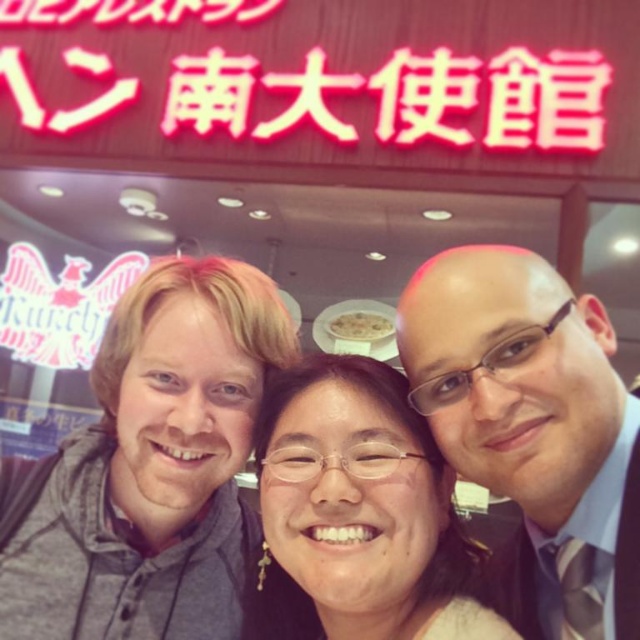
Question: Which is farther from the matte black hair at center?

Choices:
 (A) neon red sign at upper center
 (B) matte black suit at center

Answer: (A)

Question: Can you confirm if matte black suit at center is wider than gray fabric at center?

Choices:
 (A) yes
 (B) no

Answer: (B)

Question: Which is farther from the neon red sign at upper center?

Choices:
 (A) matte black hair at center
 (B) matte black suit at center
 (C) gray fabric at center

Answer: (A)

Question: Which point is farther from the camera taking this photo?

Choices:
 (A) (282, 620)
 (B) (477, 355)

Answer: (A)

Question: Does gray hoodie at center have a greater width compared to neon red sign at upper center?

Choices:
 (A) no
 (B) yes

Answer: (A)

Question: Is gray hoodie at center further to camera compared to gray fabric at center?

Choices:
 (A) no
 (B) yes

Answer: (B)